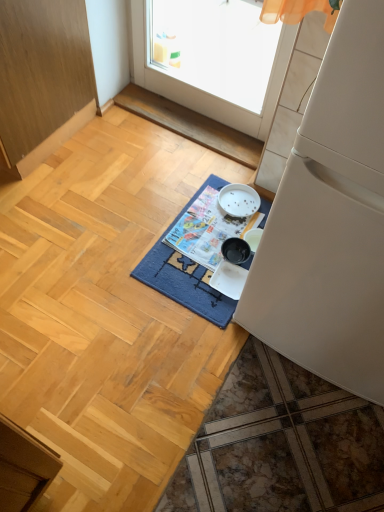
Question: Considering the relative sizes of white matte refrigerator at right and wooden cabinet at left in the image provided, is white matte refrigerator at right bigger than wooden cabinet at left?

Choices:
 (A) no
 (B) yes

Answer: (A)

Question: Is white matte refrigerator at right to the left of wooden cabinet at left from the viewer's perspective?

Choices:
 (A) no
 (B) yes

Answer: (A)

Question: Can you confirm if white matte refrigerator at right is wider than wooden cabinet at left?

Choices:
 (A) no
 (B) yes

Answer: (A)

Question: Is white matte refrigerator at right facing towards wooden cabinet at left?

Choices:
 (A) no
 (B) yes

Answer: (A)

Question: Can you confirm if white matte refrigerator at right is shorter than wooden cabinet at left?

Choices:
 (A) yes
 (B) no

Answer: (B)

Question: From the image's perspective, is white matte refrigerator at right positioned above or below printed paper magazine at center?

Choices:
 (A) below
 (B) above

Answer: (B)

Question: Relative to printed paper magazine at center, is white matte refrigerator at right in front or behind?

Choices:
 (A) behind
 (B) front

Answer: (B)

Question: Looking at the image, does white matte refrigerator at right seem bigger or smaller compared to printed paper magazine at center?

Choices:
 (A) small
 (B) big

Answer: (B)

Question: Does point (342, 177) appear closer or farther from the camera than point (183, 226)?

Choices:
 (A) farther
 (B) closer

Answer: (B)

Question: Considering the positions of blue woven mat at center and wooden cabinet at left in the image, is blue woven mat at center wider or thinner than wooden cabinet at left?

Choices:
 (A) thin
 (B) wide

Answer: (A)

Question: From a real-world perspective, is blue woven mat at center physically located above or below wooden cabinet at left?

Choices:
 (A) above
 (B) below

Answer: (B)

Question: Based on their sizes in the image, would you say blue woven mat at center is bigger or smaller than wooden cabinet at left?

Choices:
 (A) big
 (B) small

Answer: (B)

Question: In the image, is blue woven mat at center on the left side or the right side of wooden cabinet at left?

Choices:
 (A) left
 (B) right

Answer: (B)

Question: Looking at the image, does wooden cabinet at left seem bigger or smaller compared to blue woven mat at center?

Choices:
 (A) big
 (B) small

Answer: (A)

Question: Is wooden cabinet at left in front of or behind blue woven mat at center in the image?

Choices:
 (A) behind
 (B) front

Answer: (B)